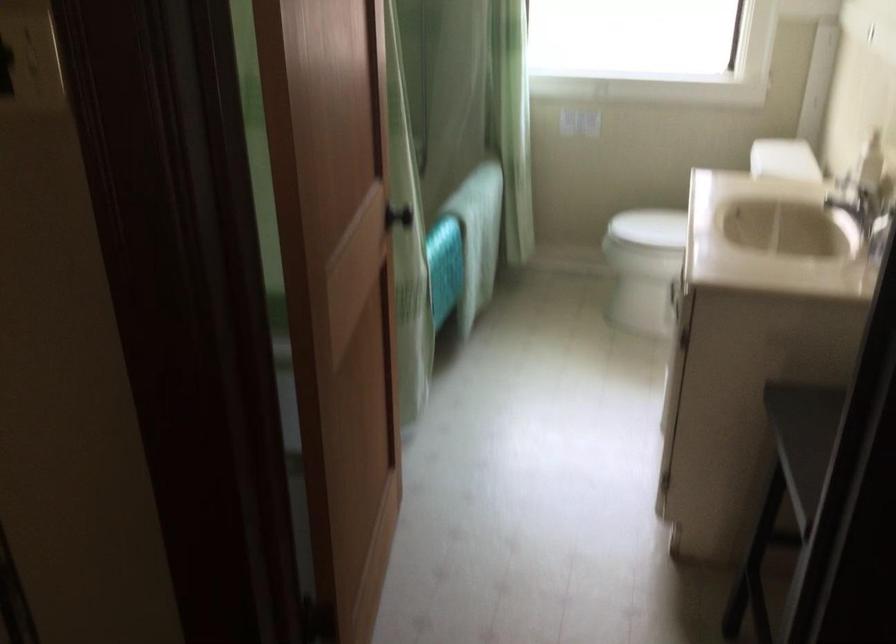
Where would you turn the black door handle? Please return your answer as a coordinate pair (x, y).

(397, 216)